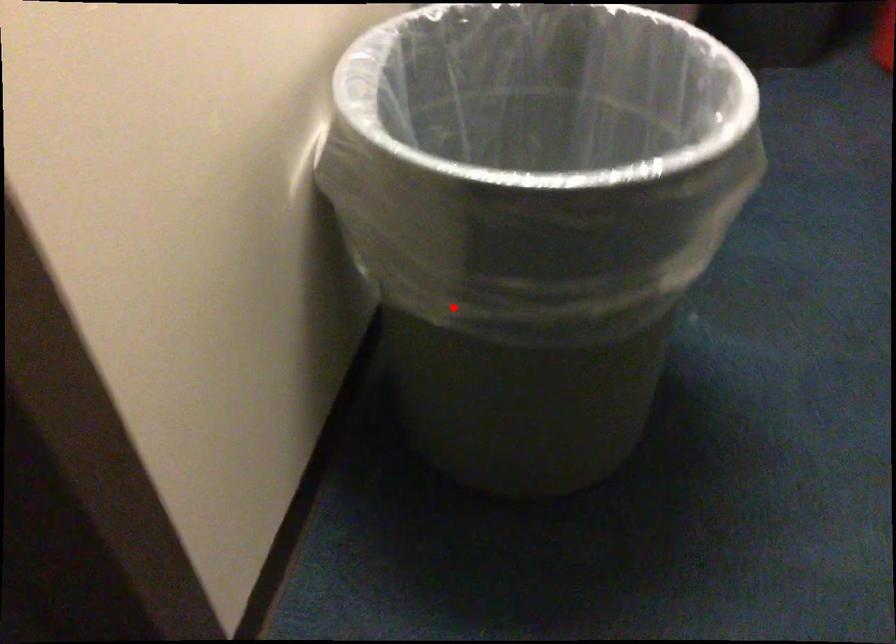
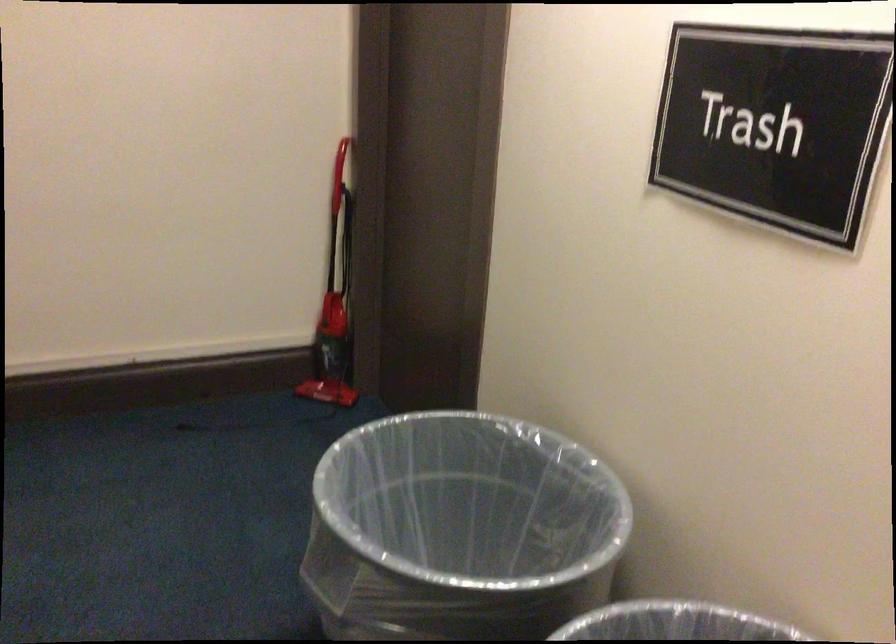
Question: I am providing you with two images of the same scene from different viewpoints. Image1 has a red point marked. In image2, the corresponding 3D location appears at what relative position? Reply with the corresponding letter.

Choices:
 (A) Closer
 (B) Farther

Answer: (B)